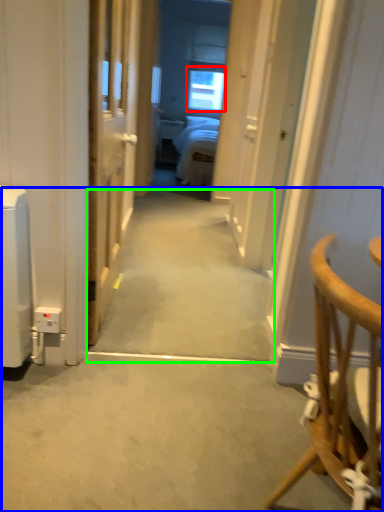
Question: Which object is positioned farthest from window (highlighted by a red box)? Select from path (highlighted by a blue box) and path (highlighted by a green box).

Choices:
 (A) path
 (B) path

Answer: (A)